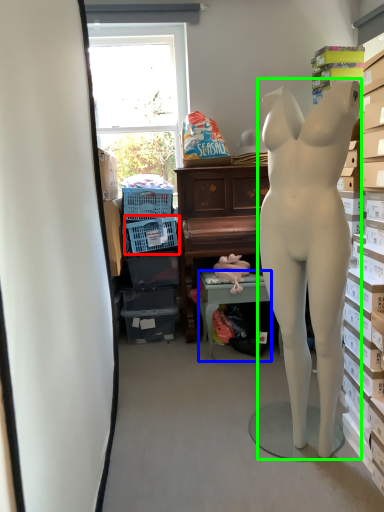
Question: Estimate the real-world distances between objects in this image. Which object is closer to laundry basket (highlighted by a red box), table (highlighted by a blue box) or person (highlighted by a green box)?

Choices:
 (A) table
 (B) person

Answer: (A)